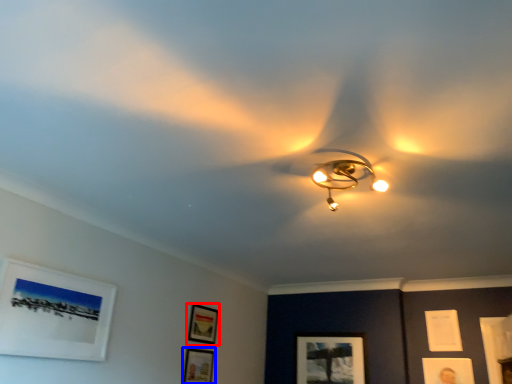
Question: Which object is further to the camera taking this photo, picture frame (highlighted by a red box) or picture frame (highlighted by a blue box)?

Choices:
 (A) picture frame
 (B) picture frame

Answer: (A)